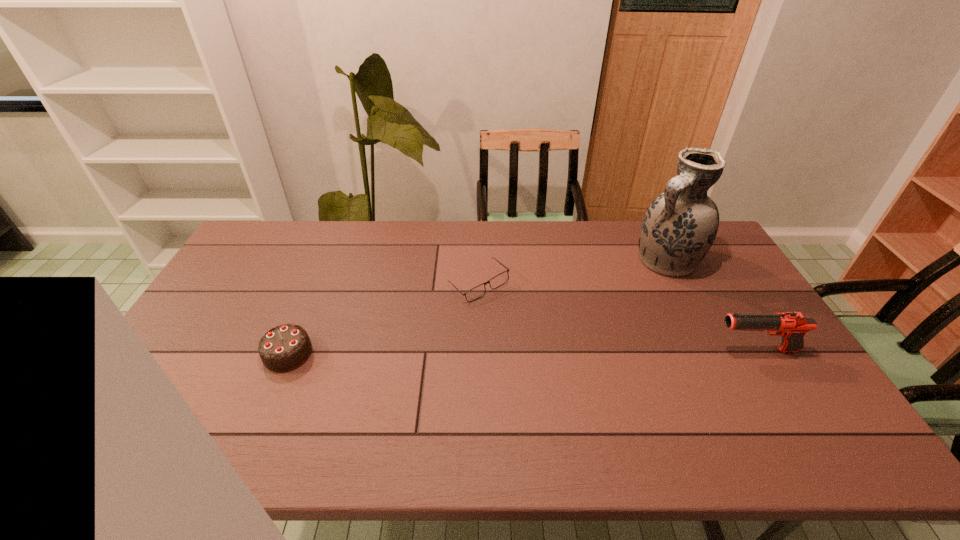
The image size is (960, 540). Identify the location of chocolate cake. (284, 348).

The image size is (960, 540). I want to click on the leftmost object, so click(x=284, y=348).

At what (x,y) coordinates should I click in order to perform the action: click on gun. Please return your answer as a coordinate pair (x, y). The width and height of the screenshot is (960, 540). Looking at the image, I should click on (792, 326).

Where is `vase`? The width and height of the screenshot is (960, 540). vase is located at coordinates [x=679, y=227].

The image size is (960, 540). Find the location of `the third object from right to left`. the third object from right to left is located at coordinates [x=475, y=293].

Locate an element on the screen. The height and width of the screenshot is (540, 960). the shortest object is located at coordinates (475, 293).

Identify the location of vacant space located on the back of the third tallest object. (305, 314).

This screenshot has height=540, width=960. In order to click on vacant point located at the aiming end of the gun in this screenshot , I will do `click(649, 350)`.

This screenshot has width=960, height=540. I want to click on vacant space located 0.350m at the aiming end of the gun, so click(x=588, y=350).

This screenshot has height=540, width=960. I want to click on vacant area located 0.290m at the aiming end of the gun, so click(610, 350).